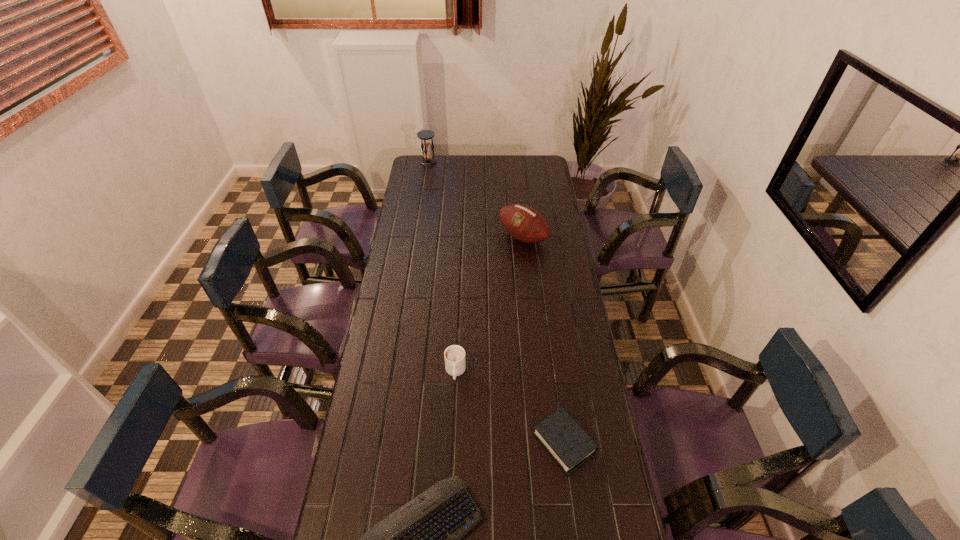
I want to click on hourglass, so click(425, 135).

Locate an element on the screen. This screenshot has width=960, height=540. football (American) is located at coordinates (524, 223).

Find the location of a particular element. The image size is (960, 540). the third nearest object is located at coordinates (454, 355).

The height and width of the screenshot is (540, 960). I want to click on the third shortest object, so click(454, 355).

Locate an element on the screen. Bible is located at coordinates (570, 446).

Locate an element on the screen. The height and width of the screenshot is (540, 960). free space located 0.390m on the front of the farthest object is located at coordinates (x=421, y=207).

The width and height of the screenshot is (960, 540). I want to click on blank space located 0.360m on the front of the football (American), so click(531, 313).

Where is `free space located 0.400m on the side with the handle of the third farthest object`? Image resolution: width=960 pixels, height=540 pixels. free space located 0.400m on the side with the handle of the third farthest object is located at coordinates (449, 511).

Identify the location of free space located 0.110m on the front of the second shortest object. (575, 517).

This screenshot has height=540, width=960. In order to click on object that is at the far edge in this screenshot , I will do `click(425, 135)`.